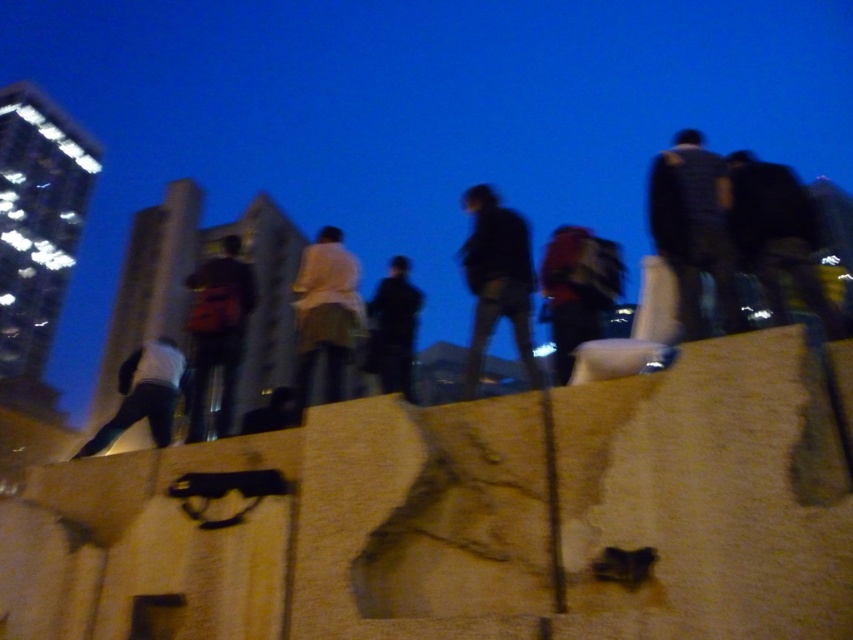
Based on the scene description, where is the white matte shirt at center located in the image?

The white matte shirt at center is located at point (325, 314).

You are standing on the rooftop and want to place a small potted plant exactly where the dark blue jeans at center are located. What are the coordinates where you should place the plant?

The coordinates for the dark blue jeans at center are [497,282], so you should place the plant at those coordinates.